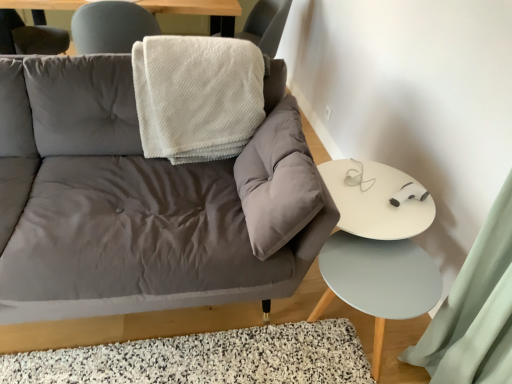
Question: Is white fluffy blanket at upper center not close to matte gray couch at center?

Choices:
 (A) yes
 (B) no

Answer: (B)

Question: Is matte gray couch at center at the back of white fluffy blanket at upper center?

Choices:
 (A) yes
 (B) no

Answer: (A)

Question: Considering the relative sizes of white fluffy blanket at upper center and matte gray couch at center in the image provided, is white fluffy blanket at upper center thinner than matte gray couch at center?

Choices:
 (A) yes
 (B) no

Answer: (A)

Question: Is matte gray couch at center located within white fluffy blanket at upper center?

Choices:
 (A) no
 (B) yes

Answer: (A)

Question: Considering the relative sizes of white fluffy blanket at upper center and matte gray couch at center in the image provided, is white fluffy blanket at upper center smaller than matte gray couch at center?

Choices:
 (A) yes
 (B) no

Answer: (A)

Question: Would you say white glossy table at right is to the left or to the right of white textured blanket at upper center in the picture?

Choices:
 (A) right
 (B) left

Answer: (A)

Question: Do you think white glossy table at right is within white textured blanket at upper center, or outside of it?

Choices:
 (A) outside
 (B) inside

Answer: (A)

Question: From a real-world perspective, is white glossy table at right positioned above or below white textured blanket at upper center?

Choices:
 (A) below
 (B) above

Answer: (A)

Question: Relative to white textured blanket at upper center, is white glossy table at right in front or behind?

Choices:
 (A) front
 (B) behind

Answer: (A)

Question: In terms of height, does white textured blanket at upper center look taller or shorter compared to light blue matte side table at lower right?

Choices:
 (A) short
 (B) tall

Answer: (B)

Question: Is white textured blanket at upper center wider or thinner than light blue matte side table at lower right?

Choices:
 (A) thin
 (B) wide

Answer: (B)

Question: In the image, is white textured blanket at upper center positioned in front of or behind light blue matte side table at lower right?

Choices:
 (A) behind
 (B) front

Answer: (A)

Question: Is point click(x=236, y=36) positioned closer to the camera than point click(x=348, y=246)?

Choices:
 (A) closer
 (B) farther

Answer: (B)

Question: Visually, is white textured blanket at upper center positioned to the left or to the right of white fluffy blanket at upper center?

Choices:
 (A) left
 (B) right

Answer: (B)

Question: In terms of width, does white textured blanket at upper center look wider or thinner when compared to white fluffy blanket at upper center?

Choices:
 (A) thin
 (B) wide

Answer: (A)